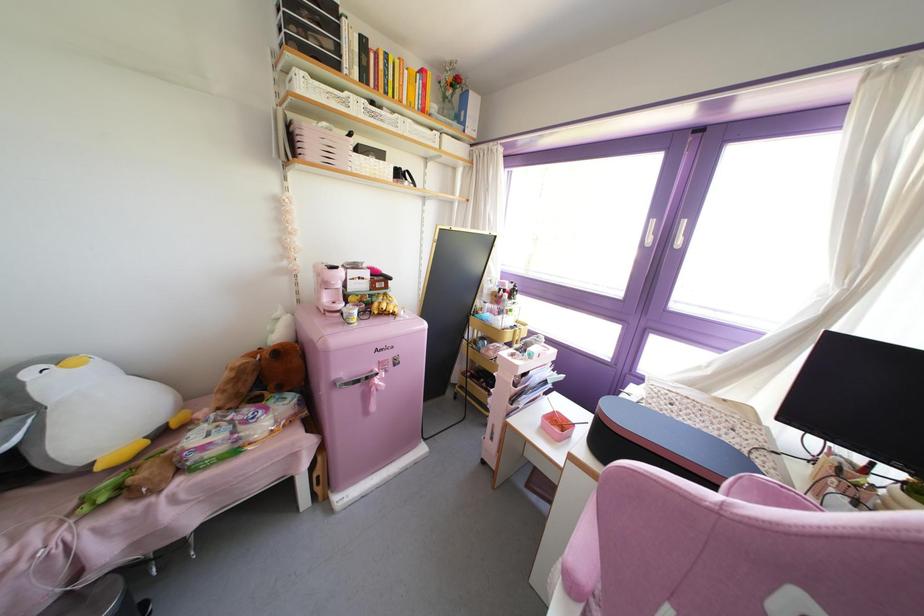
Where is `silver refrigerator handle`? silver refrigerator handle is located at coordinates (360, 378).